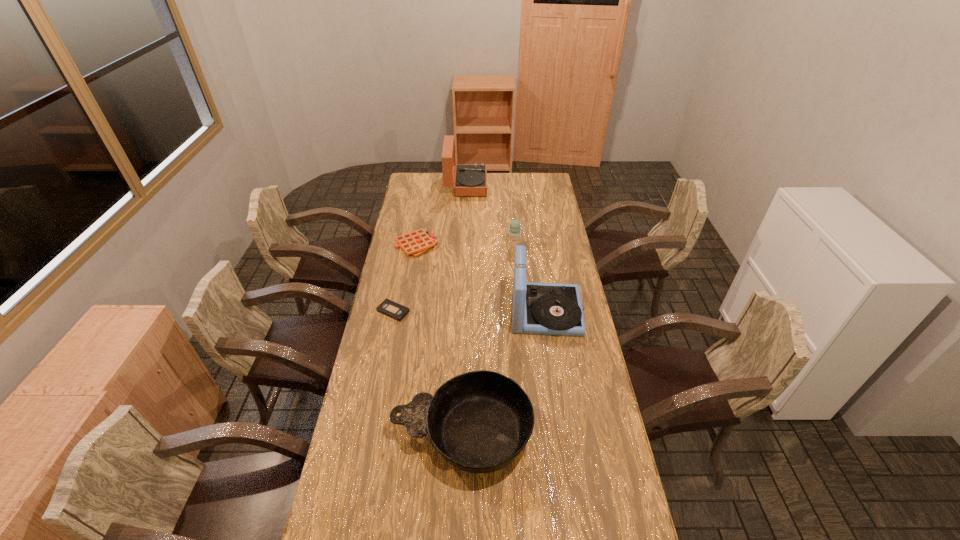
Where is `object positioned at the right edge`? object positioned at the right edge is located at coordinates (556, 309).

In the image, there is a desktop. Where is `vacant area at the far edge`? vacant area at the far edge is located at coordinates (511, 185).

The height and width of the screenshot is (540, 960). What are the coordinates of `free space at the left edge of the desktop` in the screenshot? It's located at (362, 482).

Locate an element on the screen. Image resolution: width=960 pixels, height=540 pixels. vacant space at the right edge is located at coordinates (614, 536).

Find the location of a particular element. Image resolution: width=960 pixels, height=540 pixels. vacant space at the far left corner of the desktop is located at coordinates (423, 174).

This screenshot has width=960, height=540. What are the coordinates of `free region at the far right corner of the desktop` in the screenshot? It's located at (551, 183).

Image resolution: width=960 pixels, height=540 pixels. Identify the location of vacant area that lies between the waffle and the third tallest object. (466, 245).

Image resolution: width=960 pixels, height=540 pixels. Identify the location of blank region between the ice cream and the nearer phonograph record. (530, 279).

Image resolution: width=960 pixels, height=540 pixels. What are the coordinates of `free space between the right phonograph record and the nearest object` in the screenshot? It's located at (504, 373).

You are a GUI agent. You are given a task and a screenshot of the screen. Output one action in this format:
    pyautogui.click(x=<x>, y=<y>)
    Task: Click on the free spot between the left phonograph record and the nearest object
    This screenshot has height=540, width=960.
    Given the screenshot: What is the action you would take?
    coord(464,309)